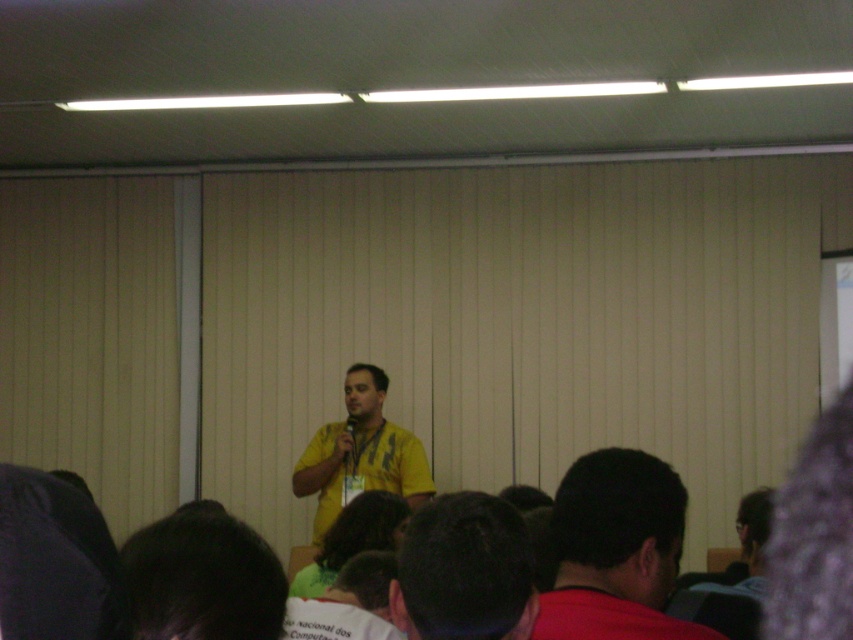
Question: Is yellow shirt at center further to the viewer compared to yellow fabric shirt at center?

Choices:
 (A) no
 (B) yes

Answer: (A)

Question: From the image, what is the correct spatial relationship of red matte shirt at center in relation to yellow fabric shirt at center?

Choices:
 (A) below
 (B) above

Answer: (B)

Question: Can you confirm if red matte shirt at center is positioned to the right of yellow fabric shirt at center?

Choices:
 (A) yes
 (B) no

Answer: (A)

Question: Considering the real-world distances, which object is closest to the red matte shirt at center?

Choices:
 (A) yellow shirt at center
 (B) yellow fabric shirt at center

Answer: (A)

Question: Which of these objects is positioned farthest from the yellow fabric shirt at center?

Choices:
 (A) red matte shirt at center
 (B) yellow shirt at center

Answer: (A)

Question: Which of the following is the closest to the observer?

Choices:
 (A) yellow fabric shirt at center
 (B) red matte shirt at center
 (C) yellow shirt at center

Answer: (C)